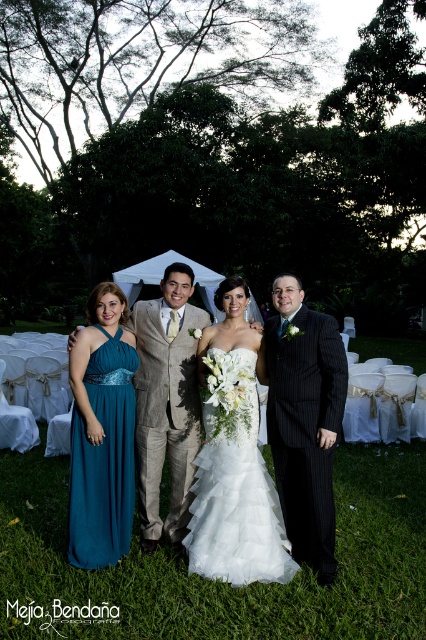
Between point (141, 333) and point (104, 336), which one is positioned behind?

Positioned behind is point (141, 333).

Between tan textured suit at center and teal chiffon dress at left, which one appears on the left side from the viewer's perspective?

teal chiffon dress at left

This screenshot has width=426, height=640. What do you see at coordinates (166, 403) in the screenshot?
I see `tan textured suit at center` at bounding box center [166, 403].

I want to click on tan textured suit at center, so click(x=166, y=403).

Does pinstriped suit at center have a larger size compared to tan textured suit at center?

Actually, pinstriped suit at center might be smaller than tan textured suit at center.

Is point (301, 460) more distant than point (187, 429)?

That is False.

Find the location of a particular element. This screenshot has height=640, width=426. pinstriped suit at center is located at coordinates (x=304, y=419).

Which is more to the right, pinstriped suit at center or white tulle dress at center?

Positioned to the right is pinstriped suit at center.

Can you confirm if pinstriped suit at center is bigger than white tulle dress at center?

Indeed, pinstriped suit at center has a larger size compared to white tulle dress at center.

Identify the location of pinstriped suit at center. (304, 419).